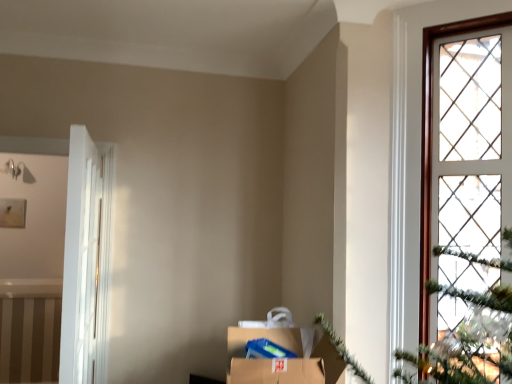
Where is `brown cardboard box at lower right`? This screenshot has width=512, height=384. brown cardboard box at lower right is located at coordinates (282, 360).

What is the approximate width of brown cardboard box at lower right?

brown cardboard box at lower right is 17.98 inches wide.

What do you see at coordinates (282, 360) in the screenshot?
I see `brown cardboard box at lower right` at bounding box center [282, 360].

Where is `brown cardboard box at lower right`? Image resolution: width=512 pixels, height=384 pixels. brown cardboard box at lower right is located at coordinates (282, 360).